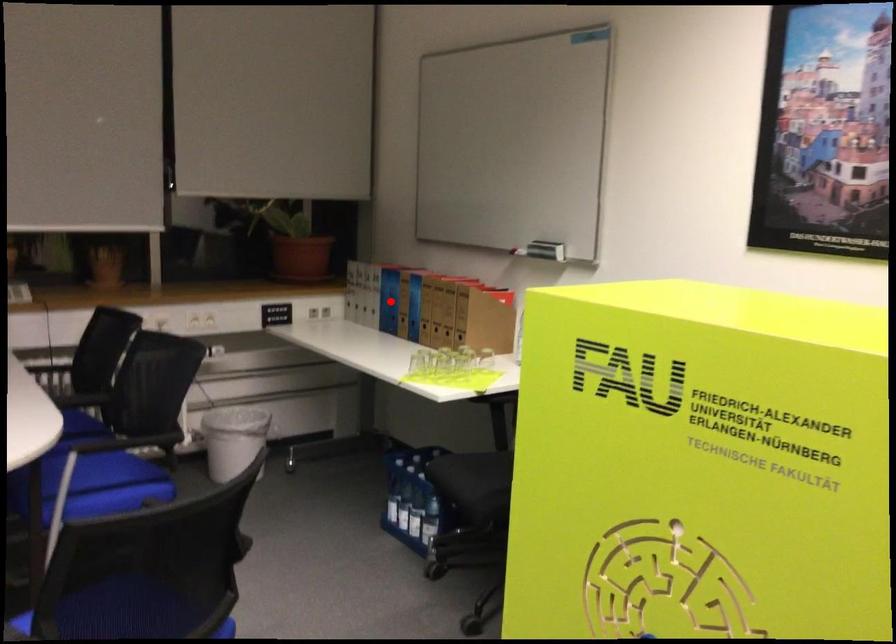
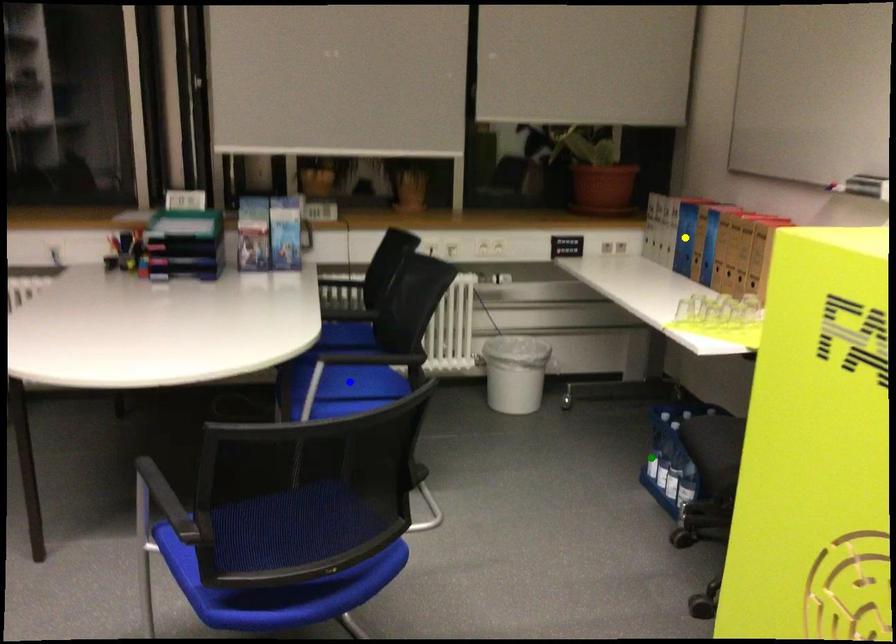
Question: I am providing you with two images of the same scene from different viewpoints. A red point is marked on the first image. You are given multiple points on the second image. Can you choose the point in image 2 that corresponds to the point in image 1?

Choices:
 (A) blue point
 (B) yellow point
 (C) green point

Answer: (B)